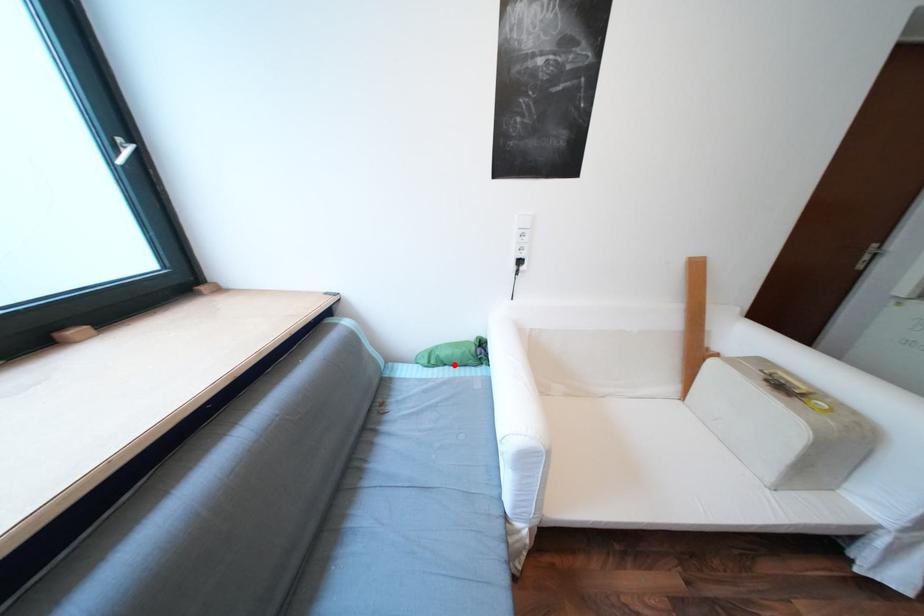
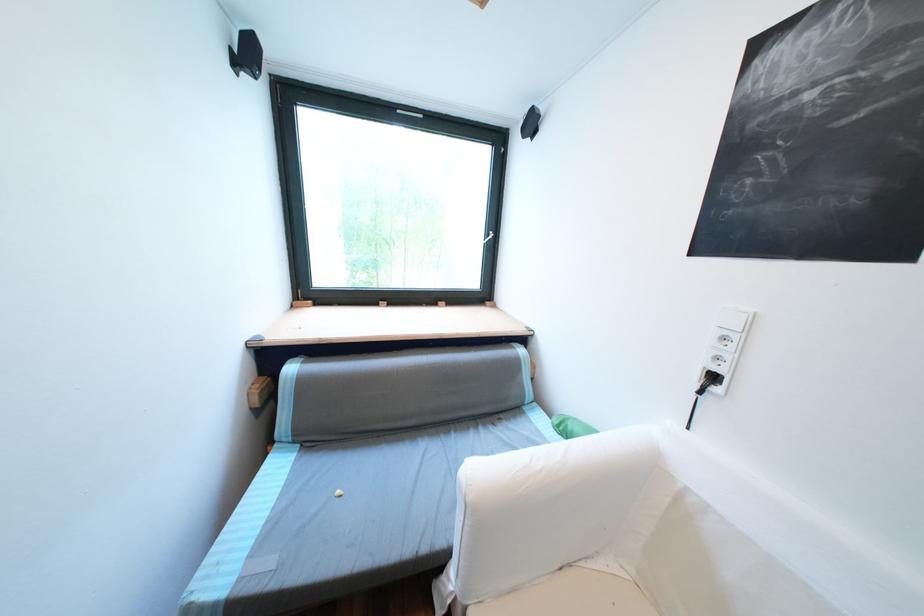
Question: I am providing you with two images of the same scene from different viewpoints. Image1 has a red point marked. In image2, the corresponding 3D location appears at what relative position? Reply with the corresponding letter.

Choices:
 (A) Closer
 (B) Farther

Answer: (A)